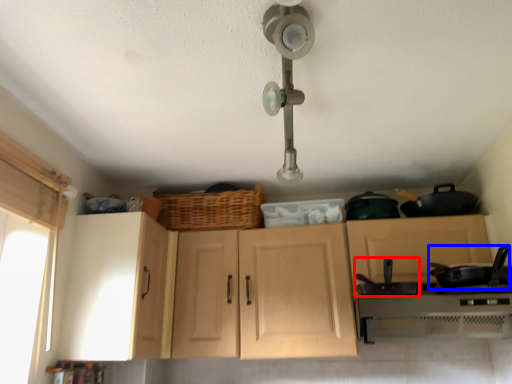
Question: Which object appears closest to the camera in this image, frying pan (highlighted by a red box) or frying pan (highlighted by a blue box)?

Choices:
 (A) frying pan
 (B) frying pan

Answer: (A)